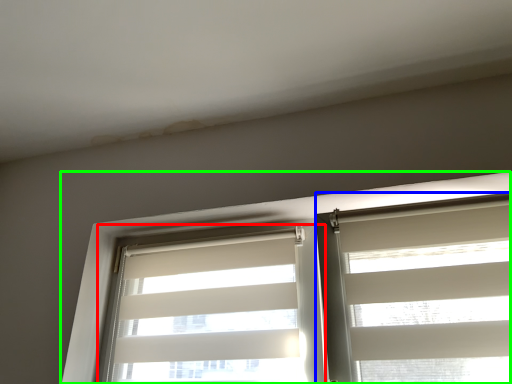
Question: Estimate the real-world distances between objects in this image. Which object is closer to window blind (highlighted by a red box), window blind (highlighted by a blue box) or window (highlighted by a green box)?

Choices:
 (A) window blind
 (B) window

Answer: (B)